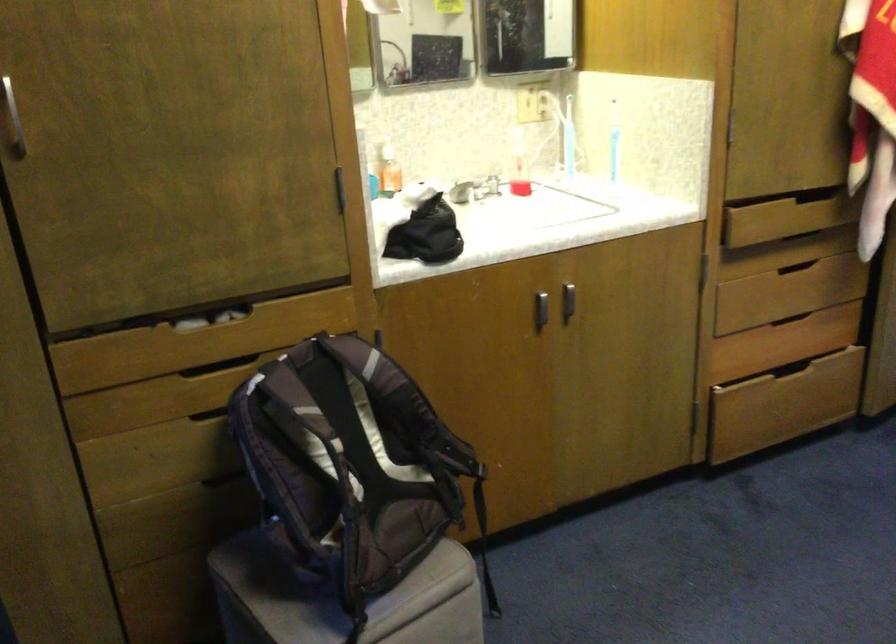
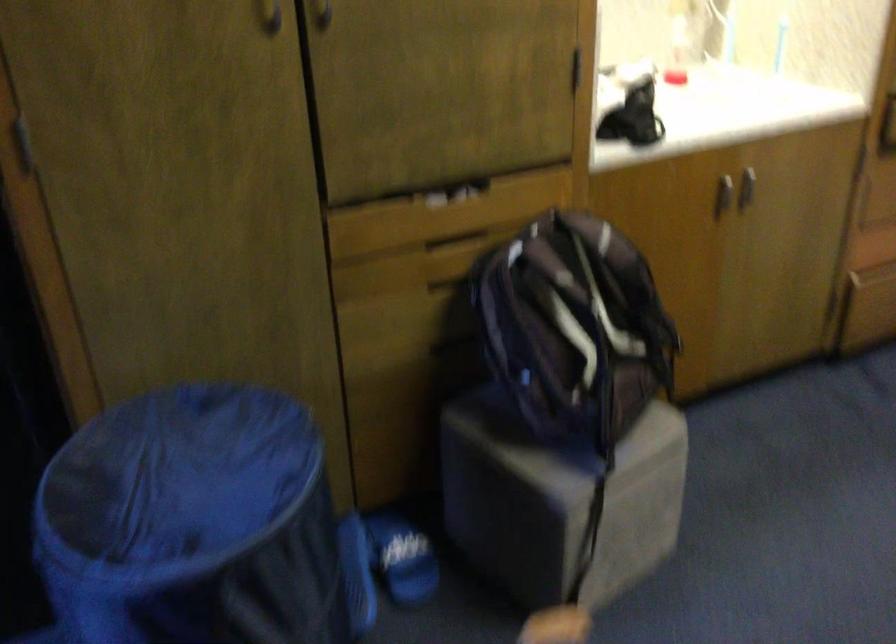
The point at (228, 366) is marked in the first image. Where is the corresponding point in the second image?

(455, 242)